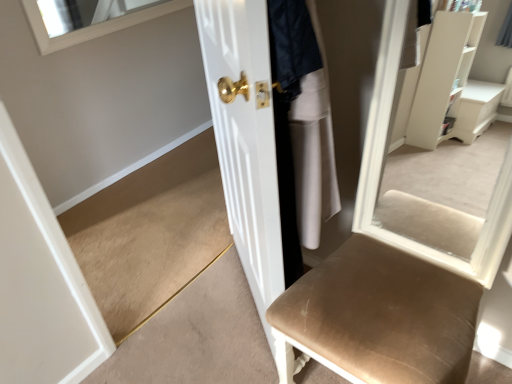
Question: Considering the positions of point (267, 196) and point (307, 145), is point (267, 196) closer or farther from the camera than point (307, 145)?

Choices:
 (A) farther
 (B) closer

Answer: (B)

Question: Is white glossy door at center to the left or to the right of white fabric skirt at center in the image?

Choices:
 (A) right
 (B) left

Answer: (B)

Question: Looking at their shapes, would you say white glossy door at center is wider or thinner than white fabric skirt at center?

Choices:
 (A) wide
 (B) thin

Answer: (B)

Question: From a real-world perspective, is white fabric skirt at center positioned above or below white glossy door at center?

Choices:
 (A) below
 (B) above

Answer: (B)

Question: In terms of height, does white fabric skirt at center look taller or shorter compared to white glossy door at center?

Choices:
 (A) tall
 (B) short

Answer: (B)

Question: Is white fabric skirt at center spatially inside white glossy door at center, or outside of it?

Choices:
 (A) inside
 (B) outside

Answer: (B)

Question: Is white fabric skirt at center wider or thinner than white glossy door at center?

Choices:
 (A) thin
 (B) wide

Answer: (B)